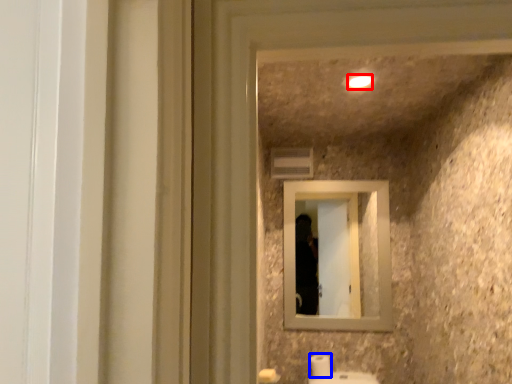
Question: Which point is closer to the camera, light (highlighted by a red box) or toilet paper (highlighted by a blue box)?

Choices:
 (A) light
 (B) toilet paper

Answer: (A)